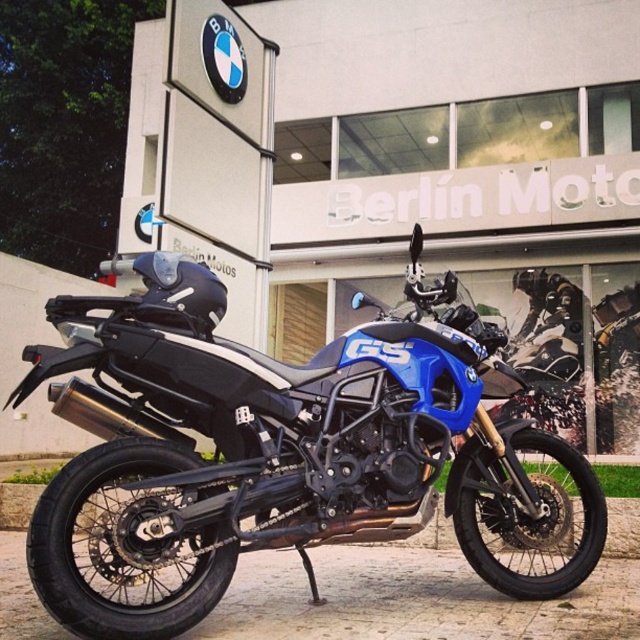
Does point (321, 248) come farther from viewer compared to point (241, 484)?

Yes, point (321, 248) is farther from viewer.

Based on the photo, does blue matte motorcycle at center lie in front of blue matte/satin gs motorcycle at center?

That is False.

Identify the location of blue matte motorcycle at center. The height and width of the screenshot is (640, 640). (467, 182).